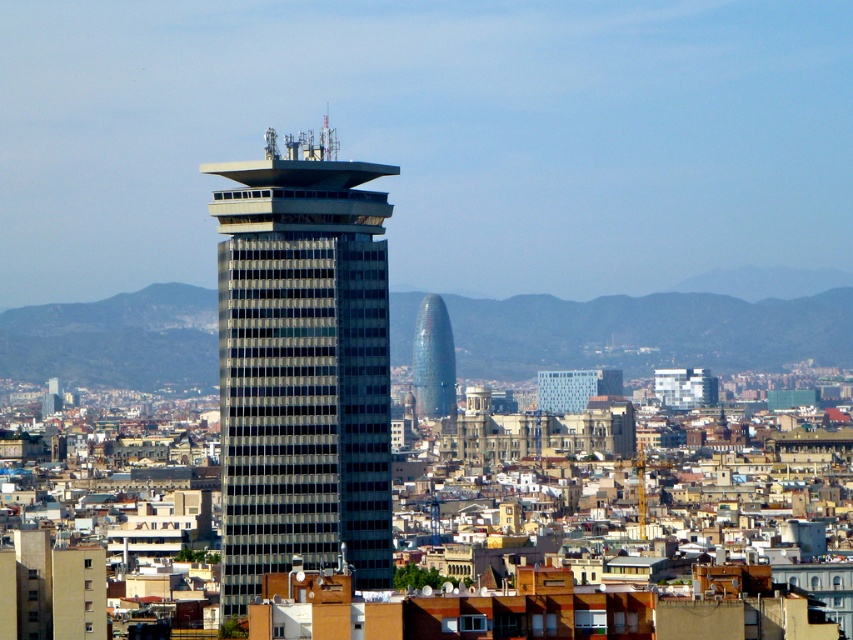
Who is shorter, matte glass skyscraper at center or blue glass tower at center?

Standing shorter between the two is blue glass tower at center.

Is matte glass skyscraper at center positioned at the back of blue glass tower at center?

No, it is not.

Does point (381, 246) lie in front of point (430, 337)?

Yes.

Identify the location of matte glass skyscraper at center. (302, 365).